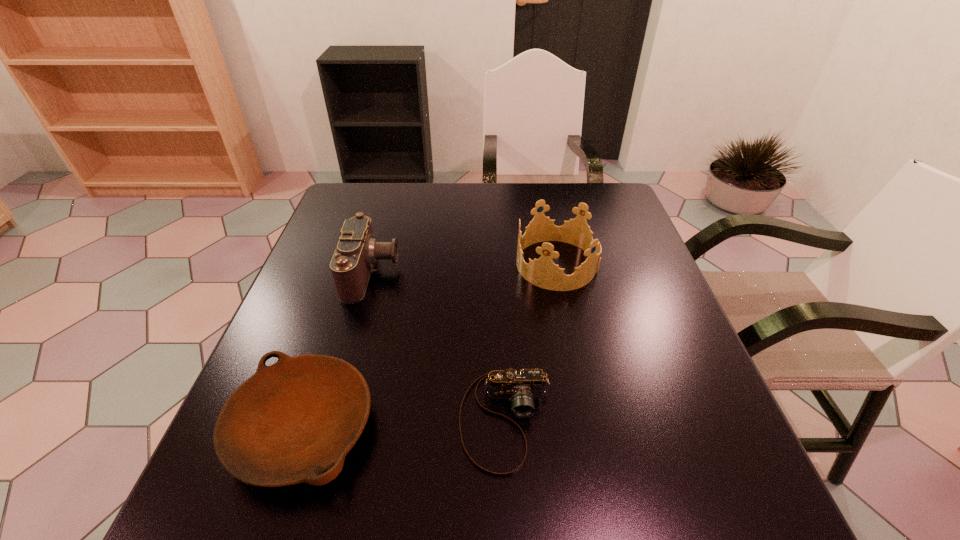
Find the location of a particular element. The image size is (960, 540). vacant position located 0.280m on the back of the plate is located at coordinates pyautogui.click(x=352, y=278).

At what (x,y) coordinates should I click in order to perform the action: click on vacant region located on the front-facing side of the right camera. Please return your answer as a coordinate pair (x, y). The height and width of the screenshot is (540, 960). Looking at the image, I should click on (x=511, y=515).

At what (x,y) coordinates should I click in order to perform the action: click on plate at the near edge. Please return your answer as a coordinate pair (x, y). The height and width of the screenshot is (540, 960). Looking at the image, I should click on (290, 422).

You are a GUI agent. You are given a task and a screenshot of the screen. Output one action in this format:
    pyautogui.click(x=<x>, y=<y>)
    Task: Click on the camera that is at the near edge
    
    Given the screenshot: What is the action you would take?
    pyautogui.click(x=521, y=387)

You are a GUI agent. You are given a task and a screenshot of the screen. Output one action in this format:
    pyautogui.click(x=<x>, y=<y>)
    Task: Click on the camera positioned at the left edge
    Image resolution: width=960 pixels, height=540 pixels.
    Given the screenshot: What is the action you would take?
    pyautogui.click(x=357, y=251)

The height and width of the screenshot is (540, 960). Find the location of `plate that is positioned at the left edge`. plate that is positioned at the left edge is located at coordinates (290, 422).

At what (x,y) coordinates should I click in order to perform the action: click on object that is at the right edge. Please return your answer as a coordinate pair (x, y). The image size is (960, 540). Looking at the image, I should click on (543, 272).

The image size is (960, 540). Identify the location of object that is at the near left corner. (290, 422).

This screenshot has height=540, width=960. Identify the location of vacant space at the far edge of the desktop. (406, 208).

This screenshot has height=540, width=960. In the image, there is a desktop. Identify the location of vacant space at the near edge. (513, 481).